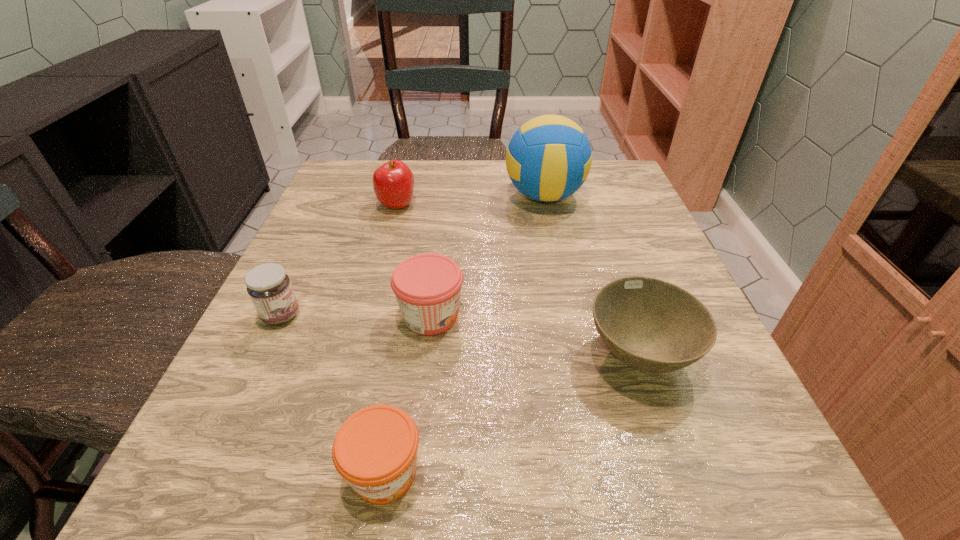
This screenshot has height=540, width=960. What are the coordinates of `vacant region at the left edge of the desktop` in the screenshot? It's located at (256, 369).

The width and height of the screenshot is (960, 540). Find the location of `free spot at the right edge of the desktop`. free spot at the right edge of the desktop is located at coordinates (682, 279).

I want to click on free space at the far left corner of the desktop, so click(x=369, y=180).

Identify the location of vacant space at the far right corner of the desktop. tap(632, 194).

Find the location of a particular element. The image size is (960, 540). vacant area that lies between the bowl and the leftmost jam is located at coordinates (460, 335).

Image resolution: width=960 pixels, height=540 pixels. What are the coordinates of `free area in between the bowl and the leftmost jam` in the screenshot? It's located at (460, 335).

The image size is (960, 540). I want to click on empty space between the nearest object and the leftmost object, so click(333, 394).

Find the location of a particular element. This screenshot has width=960, height=540. vacant space in between the second tallest object and the nearest jam is located at coordinates [x=391, y=339].

Locate an element on the screen. Image resolution: width=960 pixels, height=540 pixels. free space between the apple and the volleyball is located at coordinates (470, 201).

You are a GUI agent. You are given a task and a screenshot of the screen. Output one action in this format:
    pyautogui.click(x=<x>, y=<y>)
    Task: Click on the free space between the apple and the leftmost jam
    
    Given the screenshot: What is the action you would take?
    pyautogui.click(x=339, y=260)